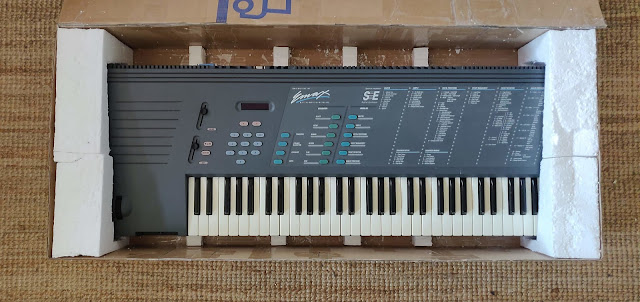
Image resolution: width=640 pixels, height=302 pixels. I want to click on keypad, so click(241, 142).